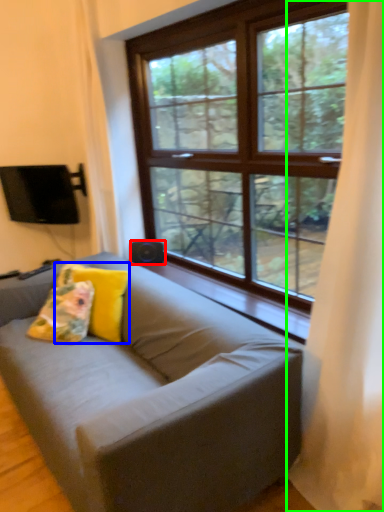
Question: Estimate the real-world distances between objects in this image. Which object is farther from speaker (highlighted by a red box), pillow (highlighted by a blue box) or curtain (highlighted by a green box)?

Choices:
 (A) pillow
 (B) curtain

Answer: (B)